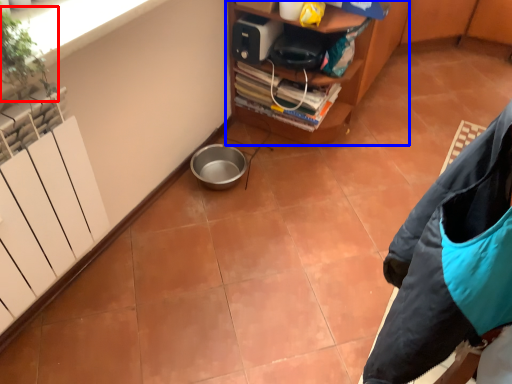
Question: Which of the following is the farthest to the observer, plant (highlighted by a red box) or furniture (highlighted by a blue box)?

Choices:
 (A) plant
 (B) furniture

Answer: (B)